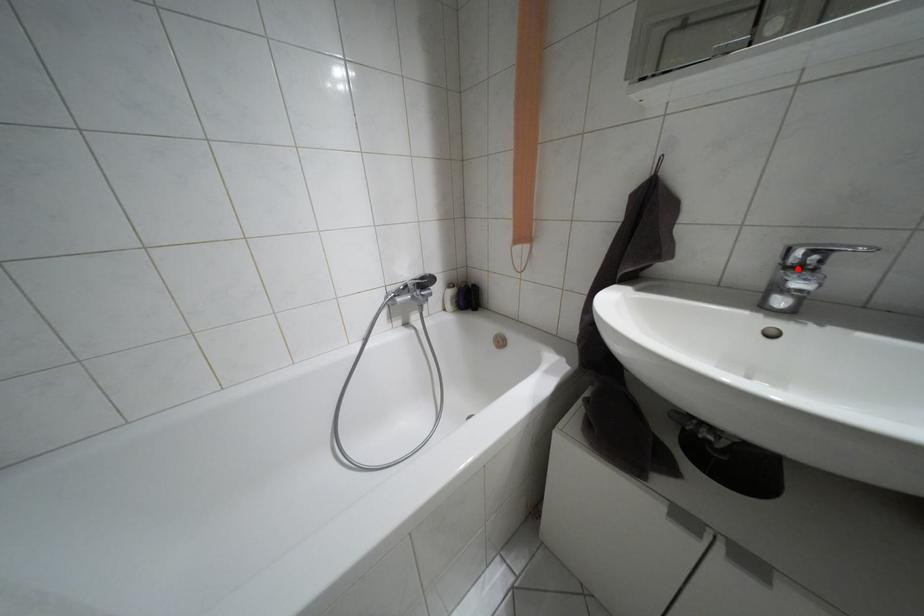
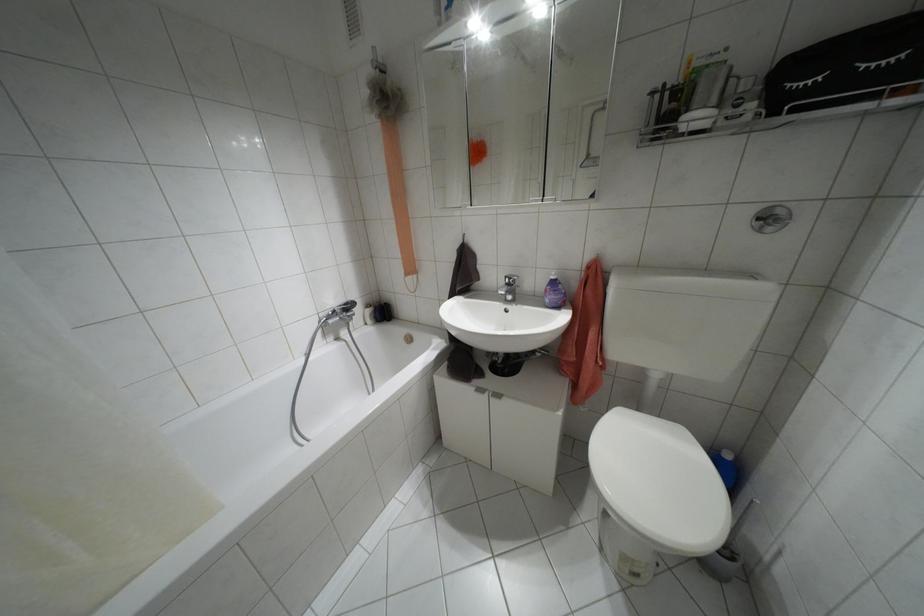
The point at the highlighted location is marked in the first image. Where is the corresponding point in the second image?

(507, 284)